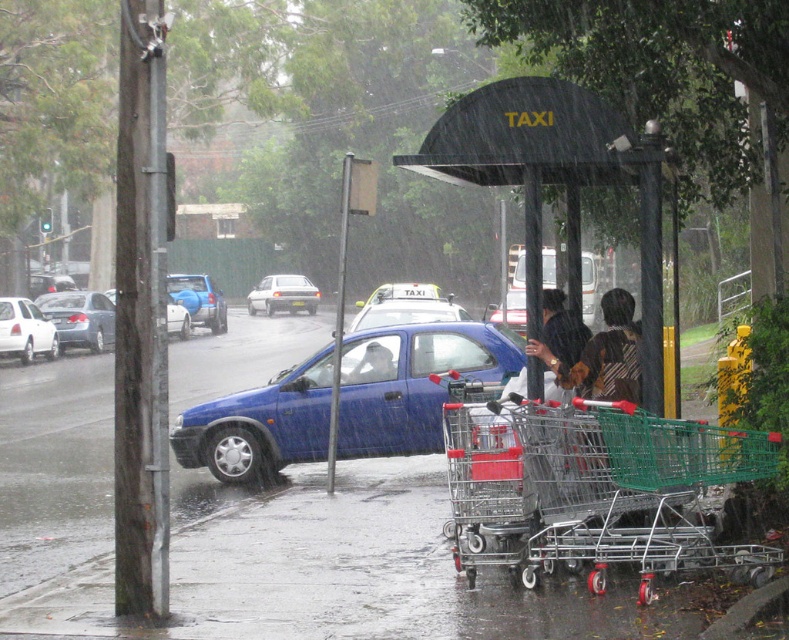
You are a taxi driver who just arrived at the taxi stand. You see the black plastic taxi stand at center and the matte black sedan at left. Which object is positioned to the right of the other?

The black plastic taxi stand at center is positioned to the right of the matte black sedan at left.

You are standing on the rainy street and want to reach the point marked as point (529, 177). Can you estimate how far you need to walk to get there?

The point (529, 177) is 9.66 meters away from the viewer, so you need to walk approximately 9.66 meters to reach it.

You are a delivery driver trying to navigate through the rainy street. You need to pass between the black plastic taxi stand at center and the matte black sedan at left. Is there enough vertical clearance for your 1.8 meters tall delivery cart to pass underneath the taxi stand?

The black plastic taxi stand at center is above the matte black sedan at left, so there is sufficient vertical clearance for a 1.8 meters tall delivery cart to pass underneath the taxi stand.